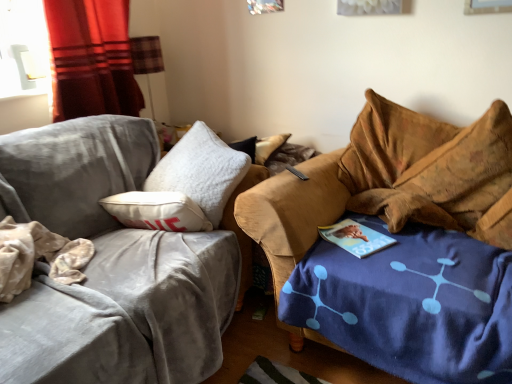
Question: From a real-world perspective, is red fabric curtain at left under velvet brown couch at right, which is counted as the 2th studio couch, starting from the left?

Choices:
 (A) yes
 (B) no

Answer: (B)

Question: From a real-world perspective, is red fabric curtain at left over velvet brown couch at right, which is counted as the 2th studio couch, starting from the left?

Choices:
 (A) yes
 (B) no

Answer: (A)

Question: From the image's perspective, is red fabric curtain at left above velvet brown couch at right, the first studio couch in the right-to-left sequence?

Choices:
 (A) no
 (B) yes

Answer: (B)

Question: From the image's perspective, is red fabric curtain at left beneath velvet brown couch at right, which is counted as the 2th studio couch, starting from the left?

Choices:
 (A) no
 (B) yes

Answer: (A)

Question: Is red fabric curtain at left surrounding velvet brown couch at right, which is counted as the 2th studio couch, starting from the left?

Choices:
 (A) no
 (B) yes

Answer: (A)

Question: Considering the relative positions of red fabric curtain at left and velvet brown couch at right, the first studio couch in the right-to-left sequence, in the image provided, is red fabric curtain at left to the right of velvet brown couch at right, the first studio couch in the right-to-left sequence, from the viewer's perspective?

Choices:
 (A) no
 (B) yes

Answer: (A)

Question: Can you confirm if velvet gray couch at left, which is the second studio couch in right-to-left order, is taller than brown velvety bean bag chair at right?

Choices:
 (A) yes
 (B) no

Answer: (A)

Question: Does velvet gray couch at left, the 1th studio couch when ordered from left to right, appear on the right side of brown velvety bean bag chair at right?

Choices:
 (A) no
 (B) yes

Answer: (A)

Question: Is brown velvety bean bag chair at right completely or partially inside velvet gray couch at left, which is the second studio couch in right-to-left order?

Choices:
 (A) yes
 (B) no

Answer: (B)

Question: Can you see velvet gray couch at left, the 1th studio couch when ordered from left to right, touching brown velvety bean bag chair at right?

Choices:
 (A) no
 (B) yes

Answer: (A)

Question: Considering the relative sizes of velvet gray couch at left, the 1th studio couch when ordered from left to right, and brown velvety bean bag chair at right in the image provided, is velvet gray couch at left, the 1th studio couch when ordered from left to right, wider than brown velvety bean bag chair at right?

Choices:
 (A) yes
 (B) no

Answer: (A)

Question: From the image's perspective, is velvet gray couch at left, which is the second studio couch in right-to-left order, located beneath brown velvety bean bag chair at right?

Choices:
 (A) no
 (B) yes

Answer: (B)

Question: Is velvet brown couch at right, the first studio couch in the right-to-left sequence, positioned with its back to plaid fabric lampshade at upper left?

Choices:
 (A) no
 (B) yes

Answer: (A)